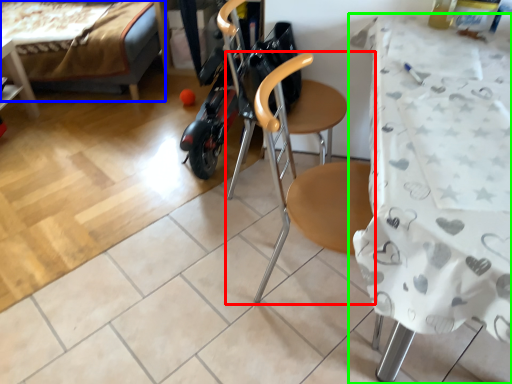
Question: Which is nearer to the chair (highlighted by a red box)? bed (highlighted by a blue box) or table (highlighted by a green box).

Choices:
 (A) bed
 (B) table

Answer: (B)